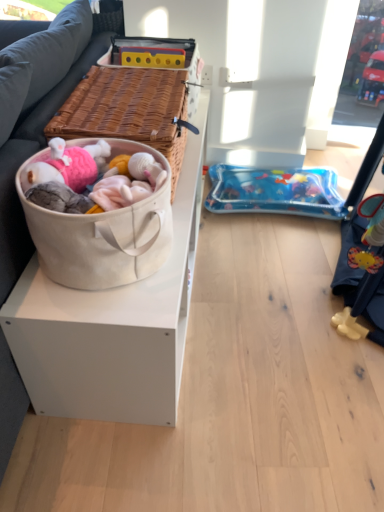
Question: From the image's perspective, does blue inflatable mattress at lower right appear lower than beige canvas basket at left?

Choices:
 (A) no
 (B) yes

Answer: (A)

Question: Is beige canvas basket at left inside blue inflatable mattress at lower right?

Choices:
 (A) no
 (B) yes

Answer: (A)

Question: Does blue inflatable mattress at lower right have a greater width compared to beige canvas basket at left?

Choices:
 (A) no
 (B) yes

Answer: (B)

Question: Is the depth of blue inflatable mattress at lower right greater than that of beige canvas basket at left?

Choices:
 (A) no
 (B) yes

Answer: (B)

Question: Can you confirm if blue inflatable mattress at lower right is taller than beige canvas basket at left?

Choices:
 (A) no
 (B) yes

Answer: (A)

Question: In terms of width, does dark gray fabric couch at left look wider or thinner when compared to woven brown picnic basket at left?

Choices:
 (A) thin
 (B) wide

Answer: (B)

Question: Do you think dark gray fabric couch at left is within woven brown picnic basket at left, or outside of it?

Choices:
 (A) outside
 (B) inside

Answer: (A)

Question: In the image, is dark gray fabric couch at left on the left side or the right side of woven brown picnic basket at left?

Choices:
 (A) right
 (B) left

Answer: (B)

Question: In terms of size, does dark gray fabric couch at left appear bigger or smaller than woven brown picnic basket at left?

Choices:
 (A) big
 (B) small

Answer: (A)

Question: Is blue inflatable mattress at lower right situated inside dark gray fabric couch at left or outside?

Choices:
 (A) outside
 (B) inside

Answer: (A)

Question: From a real-world perspective, is blue inflatable mattress at lower right physically located above or below dark gray fabric couch at left?

Choices:
 (A) above
 (B) below

Answer: (B)

Question: From the image's perspective, relative to dark gray fabric couch at left, is blue inflatable mattress at lower right above or below?

Choices:
 (A) below
 (B) above

Answer: (A)

Question: Considering the relative positions of blue inflatable mattress at lower right and dark gray fabric couch at left in the image provided, is blue inflatable mattress at lower right to the left or to the right of dark gray fabric couch at left?

Choices:
 (A) left
 (B) right

Answer: (B)

Question: Considering the positions of woven brown picnic basket at left and blue inflatable mattress at lower right in the image, is woven brown picnic basket at left taller or shorter than blue inflatable mattress at lower right?

Choices:
 (A) tall
 (B) short

Answer: (A)

Question: Does point (182, 154) appear closer or farther from the camera than point (269, 181)?

Choices:
 (A) farther
 (B) closer

Answer: (B)